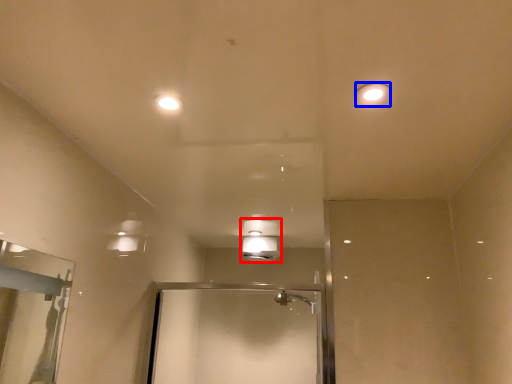
Question: Which point is closer to the camera, light fixture (highlighted by a red box) or light fixture (highlighted by a blue box)?

Choices:
 (A) light fixture
 (B) light fixture

Answer: (B)